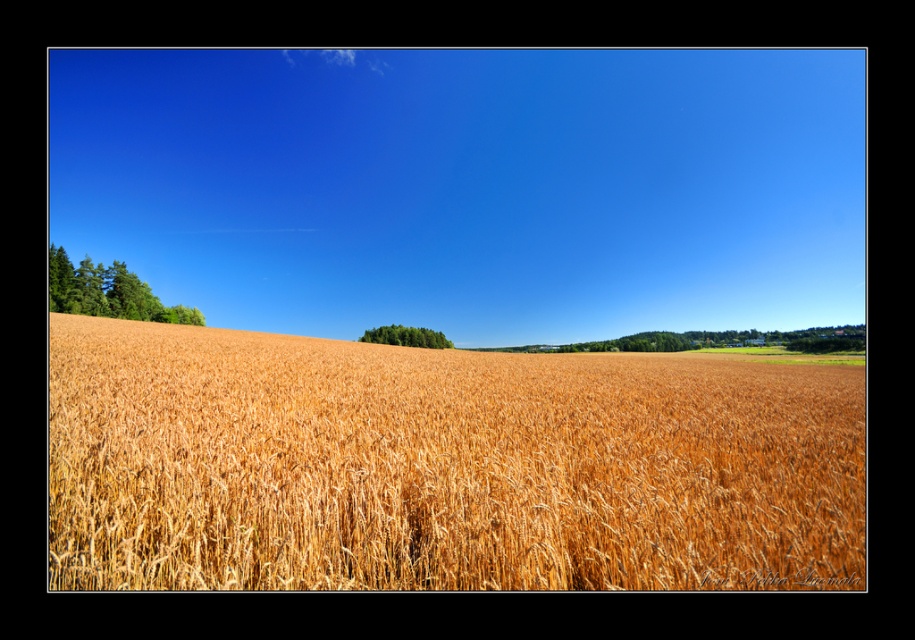
You are standing in the middle of a golden wheat field and see two points marked on the ground. The first point is at coordinates point (217, 349) and the second is at point (448, 340). Which point is closer to you?

Point (217, 349) is closer to the camera than point (448, 340), so the first point is closer to you.

You are a farmer planning to plant a new crop that requires more sunlight than the golden wheat field at center. You notice the green textured trees at left in the distance. Based on their height, would the trees cast enough shade to affect the new crop if planted near them?

The green textured trees at left are taller than the golden wheat field at center, so they would cast significant shade over the area, potentially affecting the new crop that requires more sunlight.

You are standing in a wheat field and see the green textured trees at left and the green leafy trees at center. Which group of trees is nearer to you?

The green textured trees at left are closer to the viewer than the green leafy trees at center.